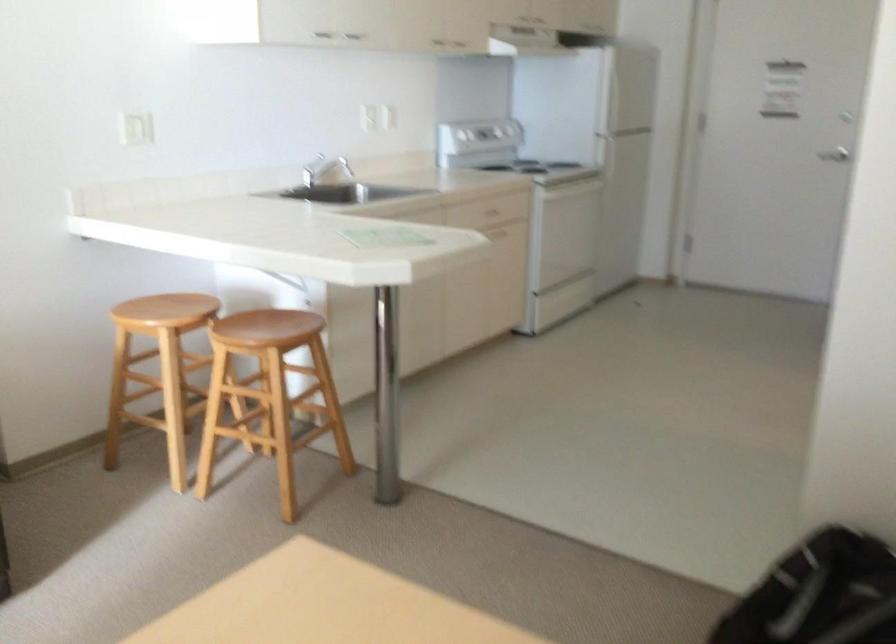
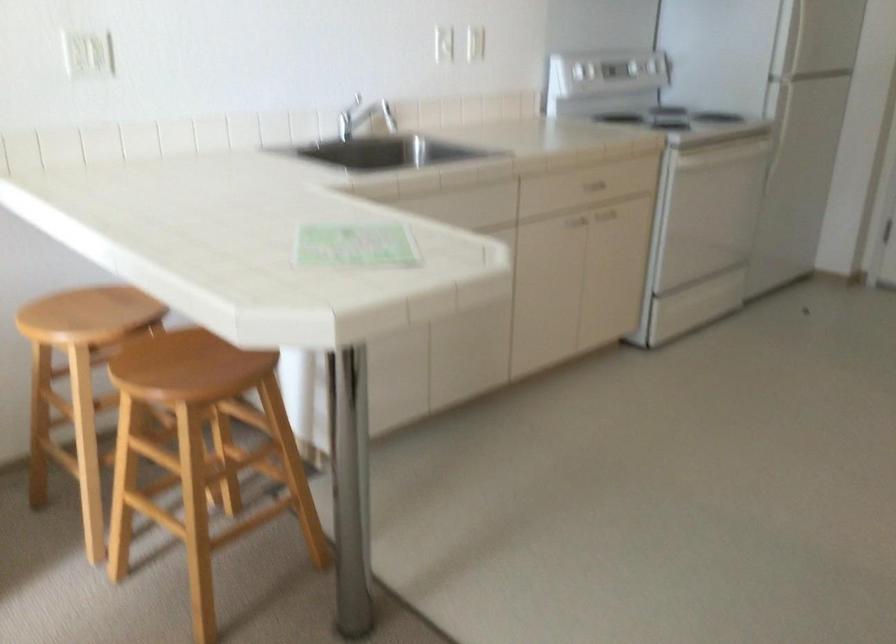
In the second image, find the point that corresponds to the point at 384,234 in the first image.

(355, 245)